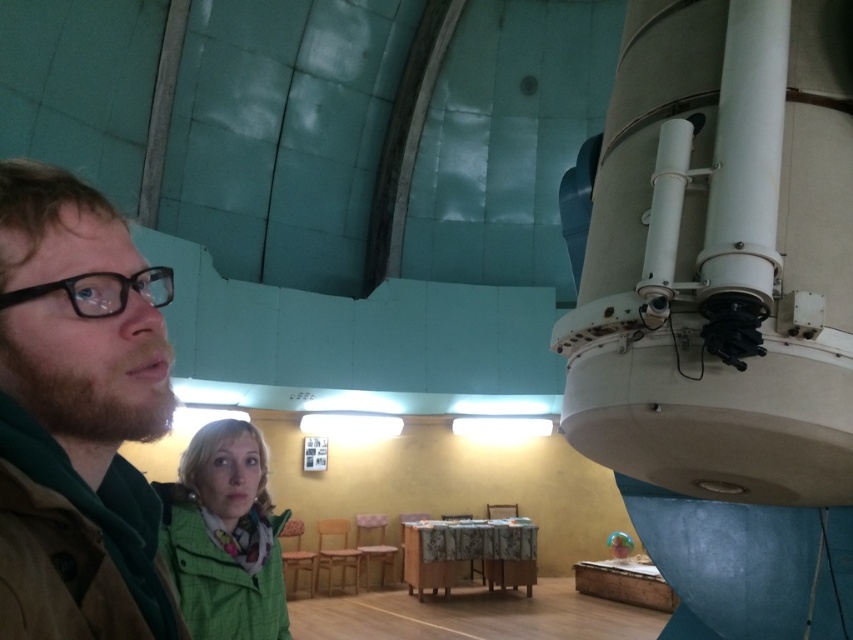
You are a fashion designer observing the image and notice two jackets. The brown leather jacket at left and the green fabric jacket at lower left. Which jacket is covering the other one?

The brown leather jacket at left is positioned over the green fabric jacket at lower left, so it is covering the green fabric jacket at lower left.

You are standing in the observatory and need to locate the brown leather jacket at left. According to the coordinates provided, where exactly is it positioned?

The brown leather jacket at left is located at point coordinates of 0.730 on the x axis and 0.096 on the y axis.